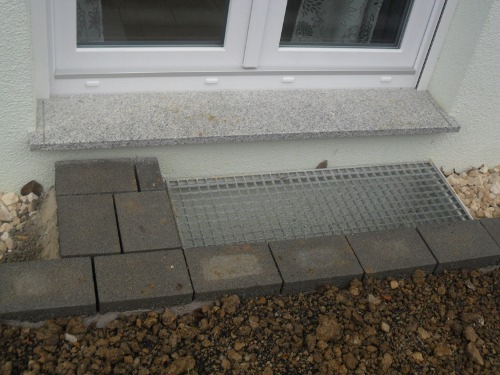
I want to click on left window, so click(155, 36).